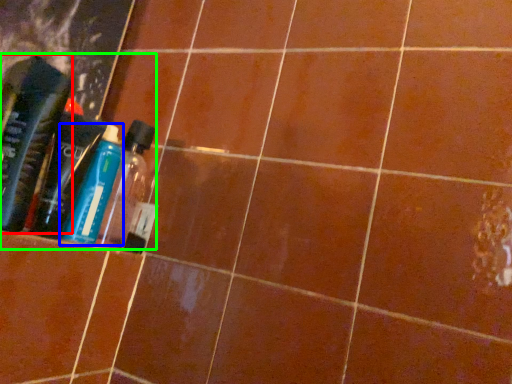
Question: Considering the real-world distances, which object is closest to bottle (highlighted by a red box)? bottle (highlighted by a blue box) or product (highlighted by a green box).

Choices:
 (A) bottle
 (B) product

Answer: (B)